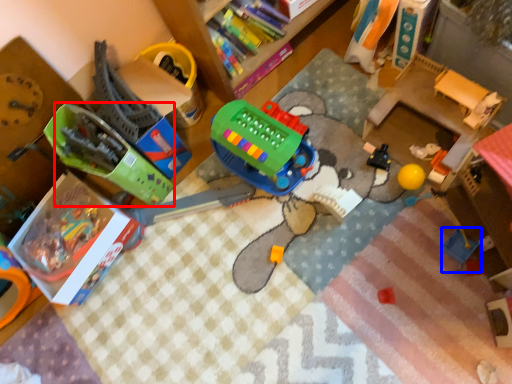
Question: Which point is further to the camera, toy (highlighted by a red box) or toy (highlighted by a blue box)?

Choices:
 (A) toy
 (B) toy

Answer: (B)